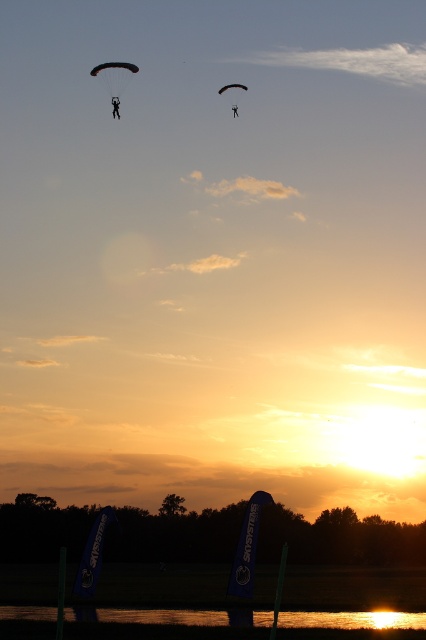
Is glistening water at lower center above black parachute at upper center?

Actually, glistening water at lower center is below black parachute at upper center.

Can you confirm if glistening water at lower center is positioned below black parachute at upper center?

Correct, glistening water at lower center is located below black parachute at upper center.

Does point (388, 625) come closer to viewer compared to point (238, 115)?

Yes, point (388, 625) is closer to viewer.

You are a GUI agent. You are given a task and a screenshot of the screen. Output one action in this format:
    pyautogui.click(x=<x>, y=<y>)
    Task: Click on the glistening water at lower center
    The height and width of the screenshot is (640, 426).
    Given the screenshot: What is the action you would take?
    pyautogui.click(x=354, y=620)

Where is `glistening water at lower center`? The image size is (426, 640). glistening water at lower center is located at coordinates (354, 620).

Is glistening water at lower center smaller than black matte parachute at upper center?

Actually, glistening water at lower center might be larger than black matte parachute at upper center.

Is point (388, 620) more distant than point (227, 86)?

No, it is in front of (227, 86).

Where is `glistening water at lower center`? Image resolution: width=426 pixels, height=640 pixels. glistening water at lower center is located at coordinates (354, 620).

Can you confirm if glistening water at lower center is wider than black matte parachute at upper left?

Incorrect, glistening water at lower center's width does not surpass black matte parachute at upper left's.

Between point (215, 625) and point (112, 92), which one is positioned in front?

Point (215, 625)

Where is `glistening water at lower center`? This screenshot has height=640, width=426. glistening water at lower center is located at coordinates (354, 620).